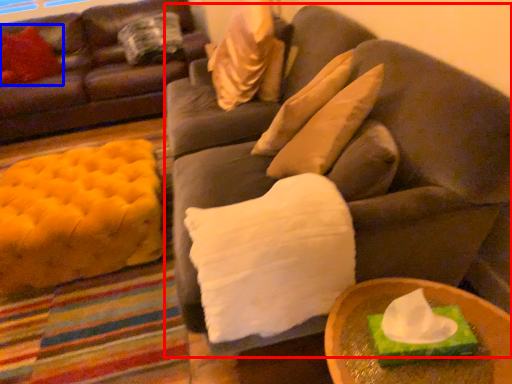
Question: Which object appears farthest to the camera in this image, studio couch (highlighted by a red box) or pillow (highlighted by a blue box)?

Choices:
 (A) studio couch
 (B) pillow

Answer: (B)